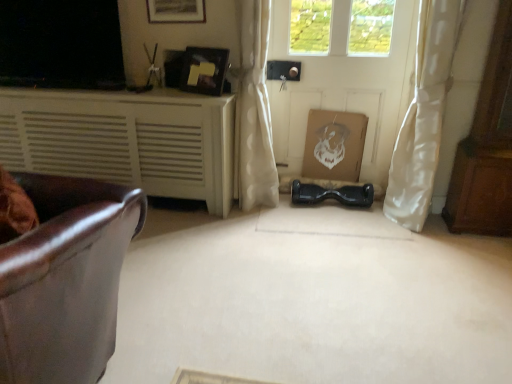
Question: Could you tell me if white sheer curtain at right, which is the 2th curtain from left to right, is turned towards wooden picture frame at upper center, marked as the 1th picture frame in a top-to-bottom arrangement?

Choices:
 (A) yes
 (B) no

Answer: (B)

Question: Does white sheer curtain at right, which is the 2th curtain from left to right, come behind wooden picture frame at upper center, marked as the 1th picture frame in a top-to-bottom arrangement?

Choices:
 (A) no
 (B) yes

Answer: (A)

Question: Can you confirm if white sheer curtain at right, the 1th curtain viewed from the right, is taller than wooden picture frame at upper center, marked as the 1th picture frame in a top-to-bottom arrangement?

Choices:
 (A) no
 (B) yes

Answer: (B)

Question: From a real-world perspective, does white sheer curtain at right, which is the 2th curtain from left to right, stand above wooden picture frame at upper center, which is counted as the second picture frame, starting from the bottom?

Choices:
 (A) yes
 (B) no

Answer: (B)

Question: Considering the relative sizes of white sheer curtain at right, the 1th curtain viewed from the right, and wooden picture frame at upper center, which is counted as the second picture frame, starting from the bottom, in the image provided, is white sheer curtain at right, the 1th curtain viewed from the right, wider than wooden picture frame at upper center, which is counted as the second picture frame, starting from the bottom,?

Choices:
 (A) no
 (B) yes

Answer: (B)

Question: Which is correct: white matte cabinet at left is inside wooden picture frame at upper center, which is counted as the second picture frame, starting from the bottom, or outside of it?

Choices:
 (A) outside
 (B) inside

Answer: (A)

Question: Is point (170, 92) closer or farther from the camera than point (154, 14)?

Choices:
 (A) closer
 (B) farther

Answer: (A)

Question: Is white matte cabinet at left to the left or to the right of wooden picture frame at upper center, which is counted as the second picture frame, starting from the bottom, in the image?

Choices:
 (A) right
 (B) left

Answer: (B)

Question: Considering the positions of white matte cabinet at left and wooden picture frame at upper center, which is counted as the second picture frame, starting from the bottom, in the image, is white matte cabinet at left wider or thinner than wooden picture frame at upper center, which is counted as the second picture frame, starting from the bottom,?

Choices:
 (A) wide
 (B) thin

Answer: (A)

Question: Is white matte door at center in front of or behind wooden picture frame at upper center, which is counted as the second picture frame, starting from the bottom, in the image?

Choices:
 (A) behind
 (B) front

Answer: (A)

Question: Considering the positions of white matte door at center and wooden picture frame at upper center, which is counted as the second picture frame, starting from the bottom, in the image, is white matte door at center taller or shorter than wooden picture frame at upper center, which is counted as the second picture frame, starting from the bottom,?

Choices:
 (A) tall
 (B) short

Answer: (A)

Question: Is white matte door at center to the left or to the right of wooden picture frame at upper center, marked as the 1th picture frame in a top-to-bottom arrangement, in the image?

Choices:
 (A) left
 (B) right

Answer: (B)

Question: Is white matte door at center bigger or smaller than wooden picture frame at upper center, which is counted as the second picture frame, starting from the bottom?

Choices:
 (A) small
 (B) big

Answer: (B)

Question: Which is correct: brown wooden dresser at right is inside wooden picture frame at upper center, which is counted as the second picture frame, starting from the bottom, or outside of it?

Choices:
 (A) inside
 (B) outside

Answer: (B)

Question: From their relative heights in the image, would you say brown wooden dresser at right is taller or shorter than wooden picture frame at upper center, marked as the 1th picture frame in a top-to-bottom arrangement?

Choices:
 (A) short
 (B) tall

Answer: (B)